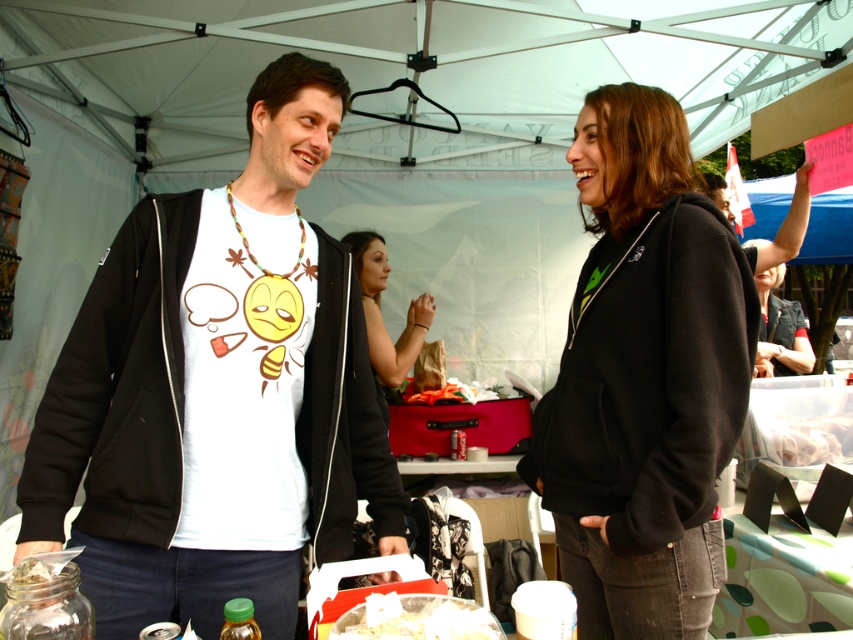
Is matte black hoodie at center below white crumbly food at center?

No, matte black hoodie at center is not below white crumbly food at center.

Does matte black hoodie at center have a greater width compared to white crumbly food at center?

Correct, the width of matte black hoodie at center exceeds that of white crumbly food at center.

Find the location of `matte black hoodie at center`. matte black hoodie at center is located at coordinates (380, 310).

Locate an element on the screen. matte black hoodie at center is located at coordinates (380, 310).

What are the coordinates of `white matte t-shirt at center` in the screenshot? It's located at (218, 392).

Measure the distance between point (315, 237) and camera.

1.45 meters

You are a GUI agent. You are given a task and a screenshot of the screen. Output one action in this format:
    pyautogui.click(x=<x>, y=<y>)
    Task: Click on the white matte t-shirt at center
    This screenshot has height=640, width=853.
    Given the screenshot: What is the action you would take?
    pyautogui.click(x=218, y=392)

Find the location of a particular element. white matte t-shirt at center is located at coordinates (218, 392).

Who is lower down, white matte t-shirt at center or translucent plastic bag at center?

translucent plastic bag at center is lower down.

Which of these two, white matte t-shirt at center or translucent plastic bag at center, stands taller?

white matte t-shirt at center

I want to click on white matte t-shirt at center, so click(x=218, y=392).